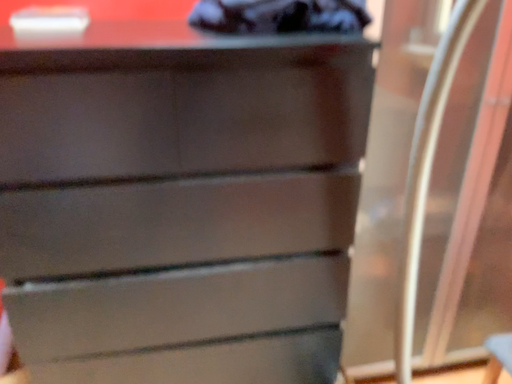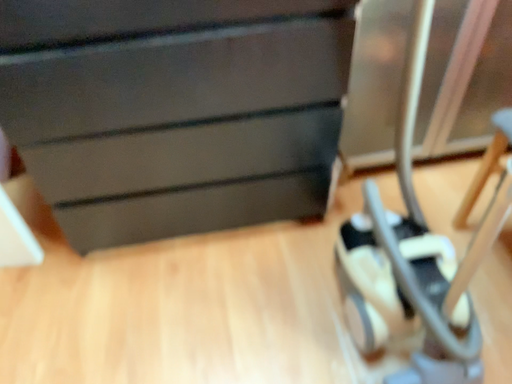
Question: Which way did the camera rotate in the video?

Choices:
 (A) rotated upward
 (B) rotated downward

Answer: (B)